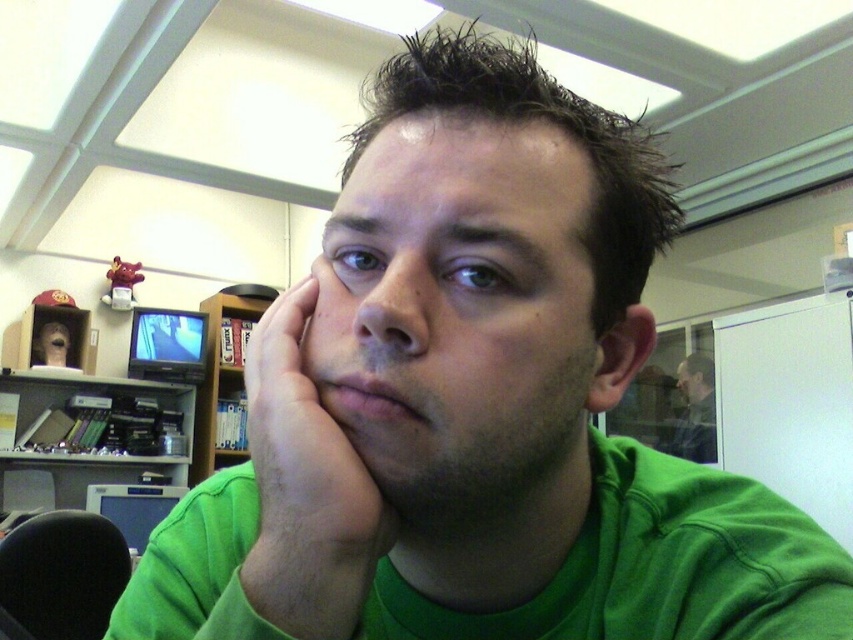
Between wooden bookshelf at upper center and matte black jacket at upper right, which one appears on the left side from the viewer's perspective?

From the viewer's perspective, wooden bookshelf at upper center appears more on the left side.

Is wooden bookshelf at upper center wider than matte black jacket at upper right?

Yes, wooden bookshelf at upper center is wider than matte black jacket at upper right.

Find the location of a particular element. The image size is (853, 640). wooden bookshelf at upper center is located at coordinates (223, 372).

Who is more forward, (247, 364) or (703, 371)?

Point (247, 364)

This screenshot has height=640, width=853. What do you see at coordinates (305, 460) in the screenshot?
I see `green matte hand at center` at bounding box center [305, 460].

Is point (256, 387) behind point (709, 387)?

No, (256, 387) is in front of (709, 387).

What are the coordinates of `green matte hand at center` in the screenshot? It's located at (305, 460).

Is point (265, 362) farther from viewer compared to point (218, 304)?

No, it is not.

Which of these two, green matte hand at center or wooden bookshelf at upper center, stands shorter?

green matte hand at center

Who is more distant from viewer, (260, 492) or (270, 296)?

Positioned behind is point (270, 296).

The width and height of the screenshot is (853, 640). In order to click on green matte hand at center in this screenshot , I will do `click(305, 460)`.